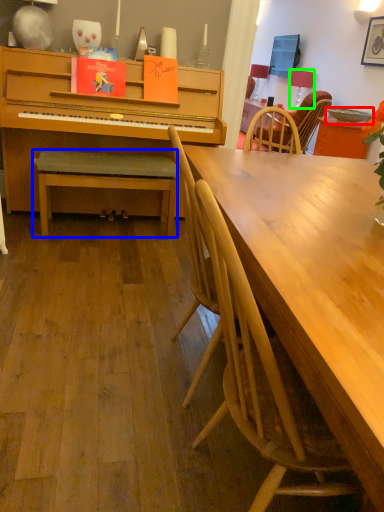
Question: Which is nearer to the bowl (highlighted by a red box)? bench (highlighted by a blue box) or lamp (highlighted by a green box).

Choices:
 (A) bench
 (B) lamp

Answer: (B)